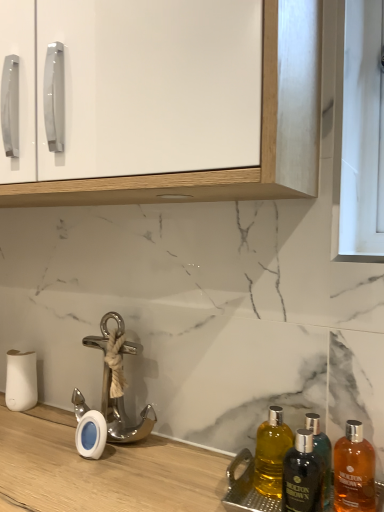
In order to face white glossy cabinet at upper center, should I rotate leftwards or rightwards?

You should look left and rotate roughly 14.143 degrees.

Where is `shiny amber glass bottle at lower right, the 1th bottle in the right-to-left sequence`? This screenshot has width=384, height=512. shiny amber glass bottle at lower right, the 1th bottle in the right-to-left sequence is located at coordinates (354, 471).

Is shiny amber glass bottle at lower right, the third bottle when ordered from left to right, shorter than yellow glass bottle at lower right, the 3th bottle in the right-to-left sequence?

In fact, shiny amber glass bottle at lower right, the third bottle when ordered from left to right, may be taller than yellow glass bottle at lower right, the 3th bottle in the right-to-left sequence.

Between shiny amber glass bottle at lower right, the third bottle when ordered from left to right, and yellow glass bottle at lower right, the 3th bottle in the right-to-left sequence, which one has larger width?

With larger width is shiny amber glass bottle at lower right, the third bottle when ordered from left to right.

From the image's perspective, is shiny amber glass bottle at lower right, the 1th bottle in the right-to-left sequence, on yellow glass bottle at lower right, which appears as the 1th bottle when viewed from the left?

No, from the image's perspective, shiny amber glass bottle at lower right, the 1th bottle in the right-to-left sequence, is not on top of yellow glass bottle at lower right, which appears as the 1th bottle when viewed from the left.

Is dark brown glass bottle at lower right, which is the 2th bottle from right to left, situated inside polished silver anchor at lower left or outside?

dark brown glass bottle at lower right, which is the 2th bottle from right to left, is located beyond the bounds of polished silver anchor at lower left.

Find the location of a particular element. the 1st bottle below the polished silver anchor at lower left (from a real-world perspective) is located at coordinates (302, 476).

From the image's perspective, is dark brown glass bottle at lower right, the second bottle when ordered from left to right, located above or below polished silver anchor at lower left?

dark brown glass bottle at lower right, the second bottle when ordered from left to right, is below polished silver anchor at lower left.

Is white glossy cabinet at upper center directly adjacent to shiny amber glass bottle at lower right, the third bottle when ordered from left to right?

No, white glossy cabinet at upper center is not making contact with shiny amber glass bottle at lower right, the third bottle when ordered from left to right.

From the image's perspective, which object appears higher, white glossy cabinet at upper center or shiny amber glass bottle at lower right, the third bottle when ordered from left to right?

white glossy cabinet at upper center is shown above in the image.

Considering the positions of objects white glossy cabinet at upper center and shiny amber glass bottle at lower right, the 1th bottle in the right-to-left sequence, in the image provided, who is in front, white glossy cabinet at upper center or shiny amber glass bottle at lower right, the 1th bottle in the right-to-left sequence,?

white glossy cabinet at upper center is closer to the camera.

Considering the sizes of objects white glossy cabinet at upper center and shiny amber glass bottle at lower right, the third bottle when ordered from left to right, in the image provided, who is shorter, white glossy cabinet at upper center or shiny amber glass bottle at lower right, the third bottle when ordered from left to right,?

shiny amber glass bottle at lower right, the third bottle when ordered from left to right.

Is polished silver anchor at lower left in front of or behind shiny amber glass bottle at lower right, the third bottle when ordered from left to right, in the image?

Visually, polished silver anchor at lower left is located behind shiny amber glass bottle at lower right, the third bottle when ordered from left to right.

Could you tell me if polished silver anchor at lower left is turned towards shiny amber glass bottle at lower right, the third bottle when ordered from left to right?

No, polished silver anchor at lower left is not oriented towards shiny amber glass bottle at lower right, the third bottle when ordered from left to right.

Does polished silver anchor at lower left have a larger size compared to shiny amber glass bottle at lower right, the 1th bottle in the right-to-left sequence?

Yes, polished silver anchor at lower left is bigger than shiny amber glass bottle at lower right, the 1th bottle in the right-to-left sequence.

Where is `tap positioned vertically above the shiny amber glass bottle at lower right, the third bottle when ordered from left to right (from a real-world perspective)`? tap positioned vertically above the shiny amber glass bottle at lower right, the third bottle when ordered from left to right (from a real-world perspective) is located at coordinates (123, 415).

Considering the points (298, 450) and (355, 445), which point is in front, point (298, 450) or point (355, 445)?

Positioned in front is point (355, 445).

From the picture: Can you confirm if dark brown glass bottle at lower right, which is the 2th bottle from right to left, is positioned to the left of shiny amber glass bottle at lower right, the third bottle when ordered from left to right?

Yes, dark brown glass bottle at lower right, which is the 2th bottle from right to left, is to the left of shiny amber glass bottle at lower right, the third bottle when ordered from left to right.

Is dark brown glass bottle at lower right, which is the 2th bottle from right to left, positioned with its back to shiny amber glass bottle at lower right, the 1th bottle in the right-to-left sequence?

No, dark brown glass bottle at lower right, which is the 2th bottle from right to left, is not facing away from shiny amber glass bottle at lower right, the 1th bottle in the right-to-left sequence.

Considering the relative sizes of white glossy cabinet at upper center and dark brown glass bottle at lower right, the second bottle when ordered from left to right, in the image provided, is white glossy cabinet at upper center bigger than dark brown glass bottle at lower right, the second bottle when ordered from left to right,?

Yes, white glossy cabinet at upper center is bigger than dark brown glass bottle at lower right, the second bottle when ordered from left to right.

How different are the orientations of white glossy cabinet at upper center and dark brown glass bottle at lower right, which is the 2th bottle from right to left, in degrees?

The angle between the facing direction of white glossy cabinet at upper center and the facing direction of dark brown glass bottle at lower right, which is the 2th bottle from right to left, is 0.0221 degrees.

How distant is white glossy cabinet at upper center from dark brown glass bottle at lower right, which is the 2th bottle from right to left?

The distance of white glossy cabinet at upper center from dark brown glass bottle at lower right, which is the 2th bottle from right to left, is 19.77 inches.

Is point (314, 93) farther from camera compared to point (296, 458)?

Yes, it is.

You are a GUI agent. You are given a task and a screenshot of the screen. Output one action in this format:
    pyautogui.click(x=<x>, y=<y>)
    Task: Click on the 1st bottle to the right of the white glossy cabinet at upper center, counting from the anchor's position
    The width and height of the screenshot is (384, 512).
    Given the screenshot: What is the action you would take?
    pyautogui.click(x=271, y=453)

Looking at this image, considering the positions of objects yellow glass bottle at lower right, which appears as the 1th bottle when viewed from the left, and white glossy cabinet at upper center in the image provided, who is in front, yellow glass bottle at lower right, which appears as the 1th bottle when viewed from the left, or white glossy cabinet at upper center?

white glossy cabinet at upper center.

From a real-world perspective, between yellow glass bottle at lower right, the 3th bottle in the right-to-left sequence, and white glossy cabinet at upper center, who is vertically lower?

yellow glass bottle at lower right, the 3th bottle in the right-to-left sequence, from a real-world perspective.

There is a shiny amber glass bottle at lower right, the third bottle when ordered from left to right. Identify the location of the 1st bottle above it (from a real-world perspective). (271, 453).

From the image's perspective, starting from the polished silver anchor at lower left, which bottle is the 2nd one below? Please provide its 2D coordinates.

[(302, 476)]

When comparing their distances from dark brown glass bottle at lower right, the second bottle when ordered from left to right, does yellow glass bottle at lower right, the 3th bottle in the right-to-left sequence, or white glossy cabinet at upper center seem further?

Based on the image, white glossy cabinet at upper center appears to be further to dark brown glass bottle at lower right, the second bottle when ordered from left to right.

When comparing their distances from dark brown glass bottle at lower right, the second bottle when ordered from left to right, does polished silver anchor at lower left or white glossy cabinet at upper center seem closer?

polished silver anchor at lower left.

Based on their spatial positions, is dark brown glass bottle at lower right, the second bottle when ordered from left to right, or polished silver anchor at lower left closer to yellow glass bottle at lower right, the 3th bottle in the right-to-left sequence?

dark brown glass bottle at lower right, the second bottle when ordered from left to right, lies closer to yellow glass bottle at lower right, the 3th bottle in the right-to-left sequence, than the other object.

Which object lies nearer to the anchor point dark brown glass bottle at lower right, which is the 2th bottle from right to left, white glossy cabinet at upper center or polished silver anchor at lower left?

polished silver anchor at lower left is positioned closer to the anchor dark brown glass bottle at lower right, which is the 2th bottle from right to left.

Considering their positions, is dark brown glass bottle at lower right, the second bottle when ordered from left to right, positioned closer to yellow glass bottle at lower right, the 3th bottle in the right-to-left sequence, than white glossy cabinet at upper center?

Based on the image, dark brown glass bottle at lower right, the second bottle when ordered from left to right, appears to be nearer to yellow glass bottle at lower right, the 3th bottle in the right-to-left sequence.

Considering their positions, is dark brown glass bottle at lower right, the second bottle when ordered from left to right, positioned closer to shiny amber glass bottle at lower right, the third bottle when ordered from left to right, than polished silver anchor at lower left?

Among the two, dark brown glass bottle at lower right, the second bottle when ordered from left to right, is located nearer to shiny amber glass bottle at lower right, the third bottle when ordered from left to right.

When comparing their distances from shiny amber glass bottle at lower right, the 1th bottle in the right-to-left sequence, does dark brown glass bottle at lower right, which is the 2th bottle from right to left, or yellow glass bottle at lower right, which appears as the 1th bottle when viewed from the left, seem closer?

dark brown glass bottle at lower right, which is the 2th bottle from right to left, lies closer to shiny amber glass bottle at lower right, the 1th bottle in the right-to-left sequence, than the other object.

Which object lies nearer to the anchor point dark brown glass bottle at lower right, the second bottle when ordered from left to right, polished silver anchor at lower left or shiny amber glass bottle at lower right, the 1th bottle in the right-to-left sequence?

shiny amber glass bottle at lower right, the 1th bottle in the right-to-left sequence, is positioned closer to the anchor dark brown glass bottle at lower right, the second bottle when ordered from left to right.

I want to click on tap between white glossy cabinet at upper center and yellow glass bottle at lower right, which appears as the 1th bottle when viewed from the left, in the up-down direction, so tap(123, 415).

Locate an element on the screen. tap that lies between white glossy cabinet at upper center and shiny amber glass bottle at lower right, the 1th bottle in the right-to-left sequence, from top to bottom is located at coordinates (123, 415).

The width and height of the screenshot is (384, 512). I want to click on tap that lies between white glossy cabinet at upper center and dark brown glass bottle at lower right, the second bottle when ordered from left to right, from top to bottom, so click(x=123, y=415).

Image resolution: width=384 pixels, height=512 pixels. Identify the location of bottle between white glossy cabinet at upper center and dark brown glass bottle at lower right, the second bottle when ordered from left to right, vertically. (271, 453).